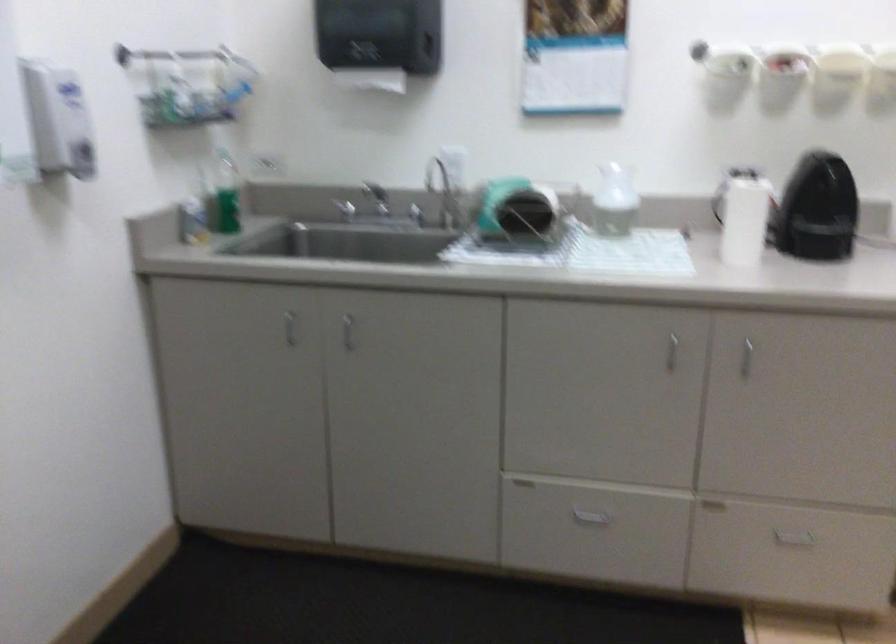
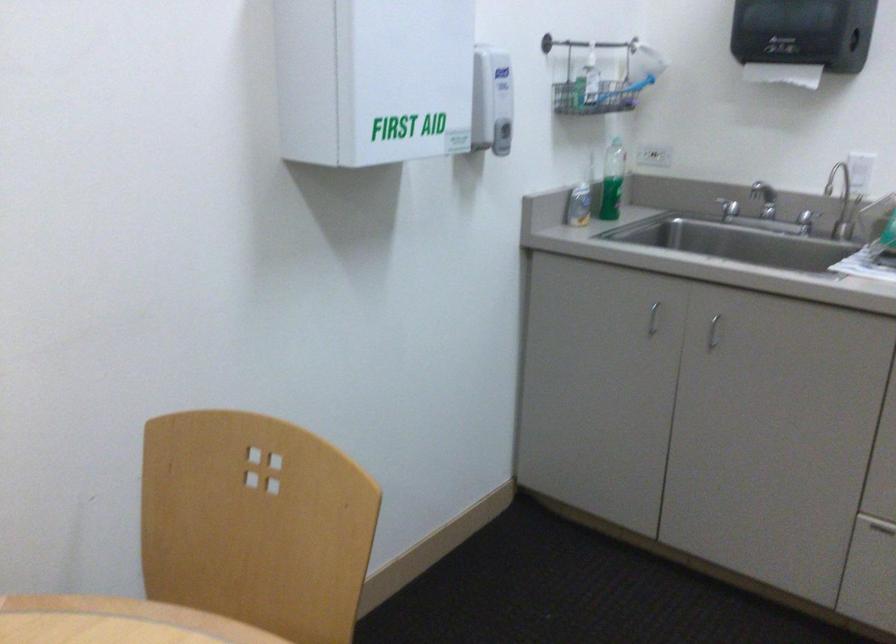
Locate, in the second image, the point that corresponds to point 409,218 in the first image.

(806, 221)